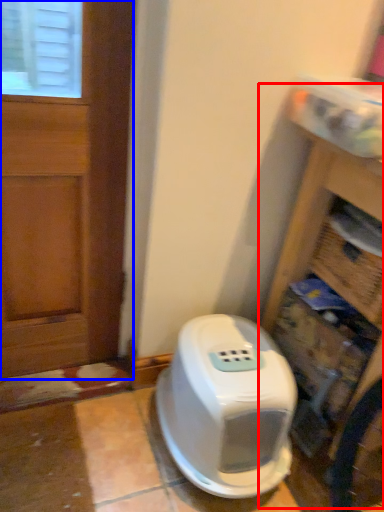
Question: Among these objects, which one is farthest to the camera, bookshelf (highlighted by a red box) or door (highlighted by a blue box)?

Choices:
 (A) bookshelf
 (B) door

Answer: (B)